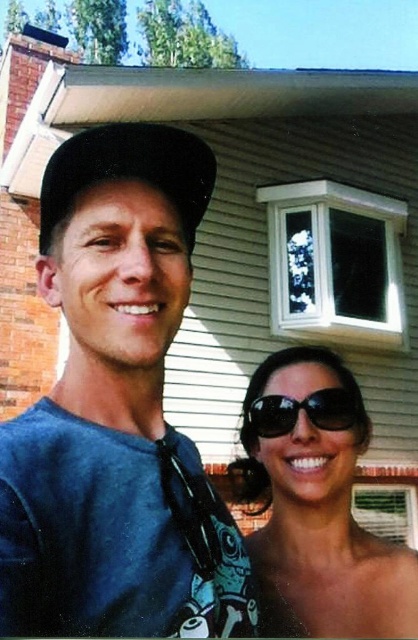
Does sunglasses at lower right have a larger size compared to black matte baseball cap at upper left?

Yes.

What do you see at coordinates (316, 506) in the screenshot? I see `sunglasses at lower right` at bounding box center [316, 506].

Locate an element on the screen. This screenshot has height=640, width=418. sunglasses at lower right is located at coordinates (316, 506).

Can you confirm if matte blue shirt at center is thinner than black matte baseball cap at upper left?

In fact, matte blue shirt at center might be wider than black matte baseball cap at upper left.

Between point (106, 161) and point (191, 198), which one is positioned behind?

The point (191, 198) is more distant.

Find the location of a particular element. The image size is (418, 640). matte blue shirt at center is located at coordinates (116, 410).

Who is positioned more to the right, sunglasses at lower right or black reflective sunglasses at center?

From the viewer's perspective, sunglasses at lower right appears more on the right side.

How far apart are sunglasses at lower right and black reflective sunglasses at center?

A distance of 3.65 inches exists between sunglasses at lower right and black reflective sunglasses at center.

At what (x,y) coordinates should I click in order to perform the action: click on sunglasses at lower right. Please return your answer as a coordinate pair (x, y). Looking at the image, I should click on [x=316, y=506].

At what (x,y) coordinates should I click in order to perform the action: click on sunglasses at lower right. Please return your answer as a coordinate pair (x, y). The width and height of the screenshot is (418, 640). Looking at the image, I should click on (316, 506).